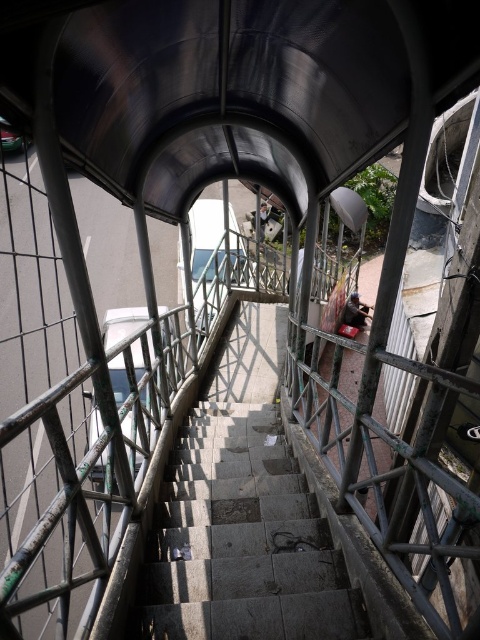
Can you confirm if gray concrete stairs at center is positioned to the left of metallic silver skateboard at center?

Indeed, gray concrete stairs at center is positioned on the left side of metallic silver skateboard at center.

Does gray concrete stairs at center have a larger size compared to metallic silver skateboard at center?

Incorrect, gray concrete stairs at center is not larger than metallic silver skateboard at center.

Image resolution: width=480 pixels, height=640 pixels. What are the coordinates of `gray concrete stairs at center` in the screenshot? It's located at (240, 540).

Identify the location of gray concrete stairs at center. The height and width of the screenshot is (640, 480). (240, 540).